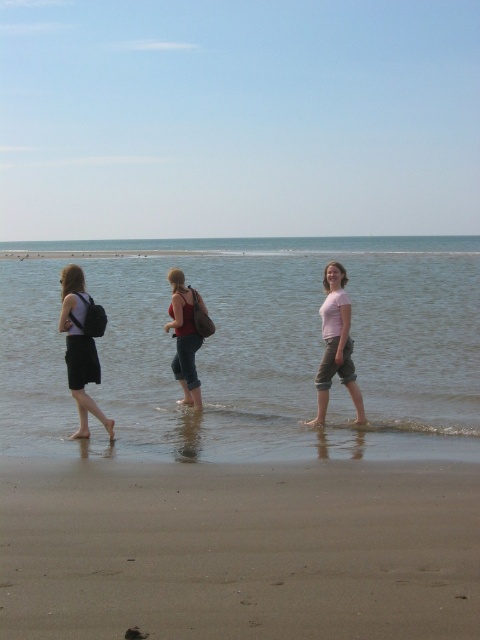
Question: Which of the following is the closest to the observer?

Choices:
 (A) (189, 304)
 (B) (46, 525)
 (C) (360, 413)
 (D) (67, 301)

Answer: (B)

Question: Can you confirm if matte black backpack at left is positioned to the right of matte black tank top at center?

Choices:
 (A) no
 (B) yes

Answer: (A)

Question: Which of the following is the farthest from the observer?

Choices:
 (A) (97, 310)
 (B) (273, 392)
 (C) (332, 310)

Answer: (B)

Question: Which point is farther from the camera taking this photo?

Choices:
 (A) (71, 310)
 (B) (282, 301)
 (C) (141, 474)

Answer: (B)

Question: Does clear water at center come in front of brown sandy beach at lower center?

Choices:
 (A) no
 (B) yes

Answer: (A)

Question: Can you confirm if clear water at center is bigger than matte black backpack at left?

Choices:
 (A) no
 (B) yes

Answer: (B)